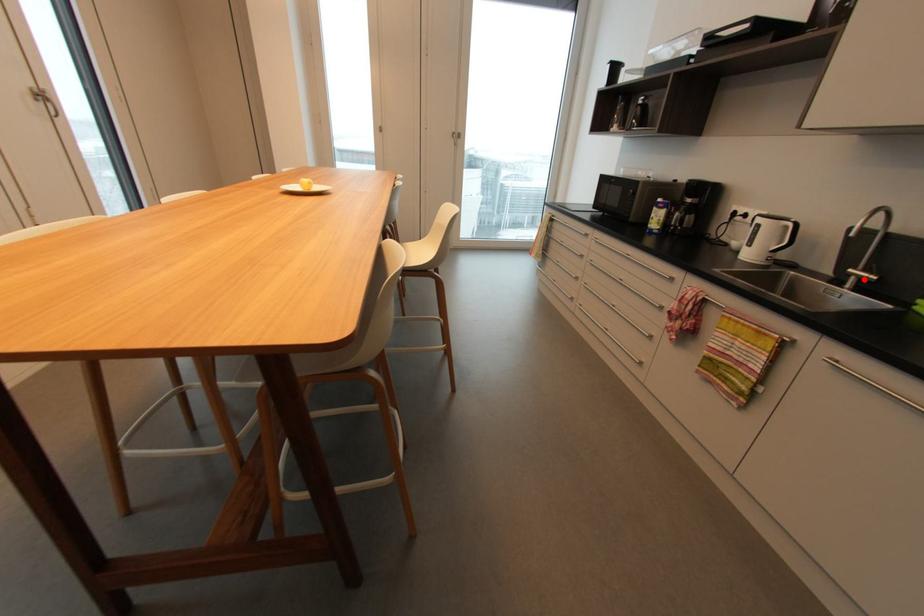
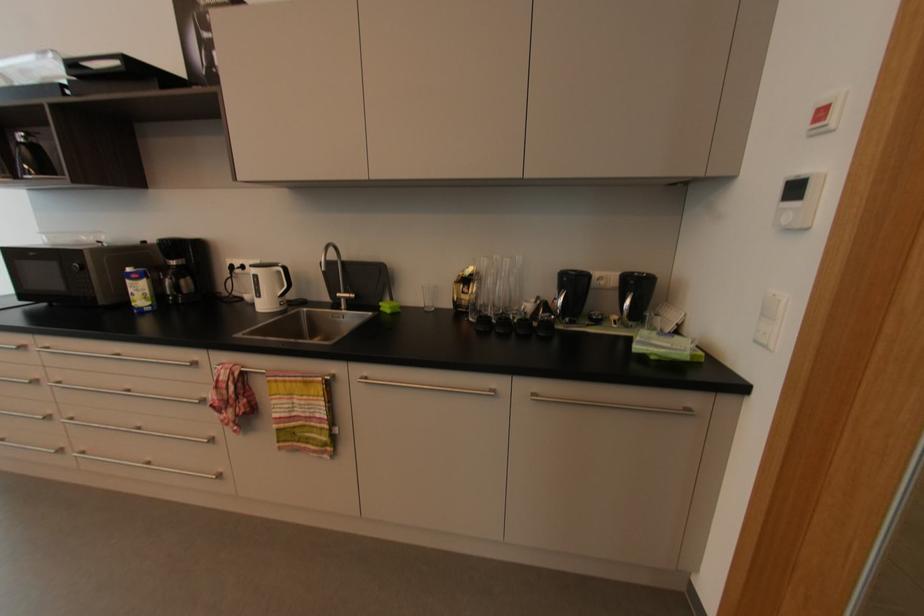
Question: I am providing you with two images of the same scene from different viewpoints. Image1 has a red point marked. In image2, the corresponding 3D location appears at what relative position? Reply with the corresponding letter.

Choices:
 (A) Closer
 (B) Farther

Answer: (A)